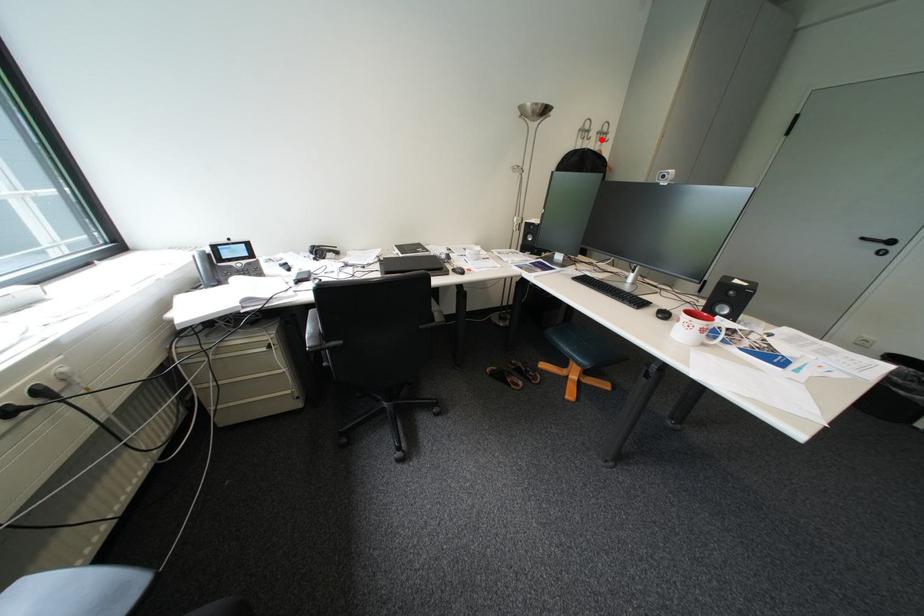
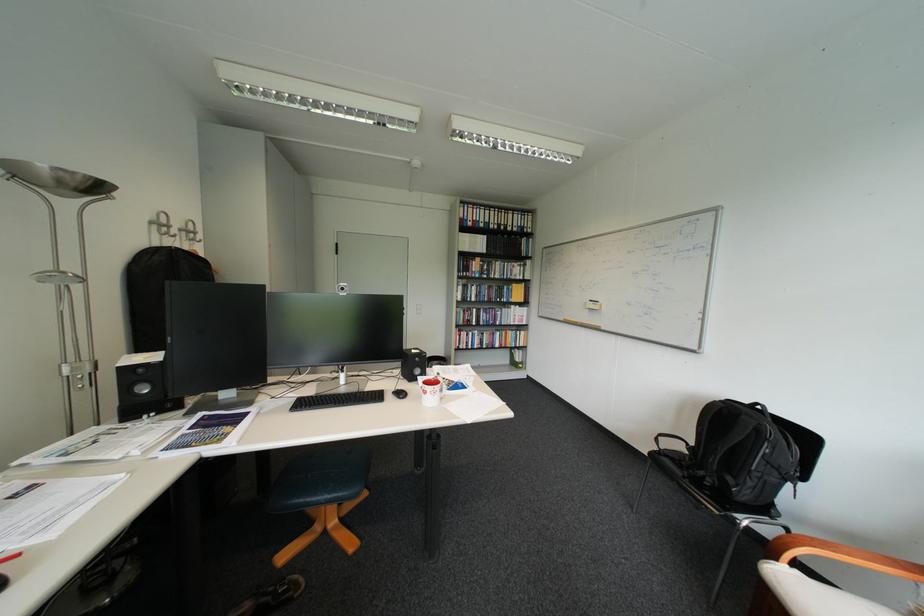
Locate, in the second image, the point that corresponds to the highlighted location in the first image.

(187, 237)